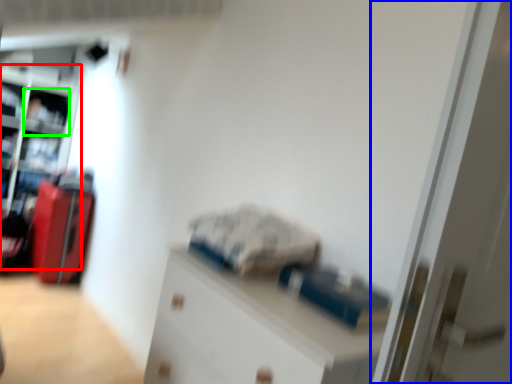
Question: Which object is positioned farthest from bookshelf (highlighted by a red box)? Select from door (highlighted by a blue box) and shelf (highlighted by a green box).

Choices:
 (A) door
 (B) shelf

Answer: (A)